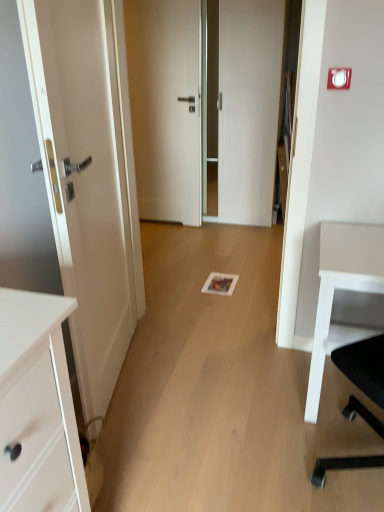
What are the coordinates of `free space to the right of white matte door at center, the third door when ordered from front to back` in the screenshot? It's located at (210, 230).